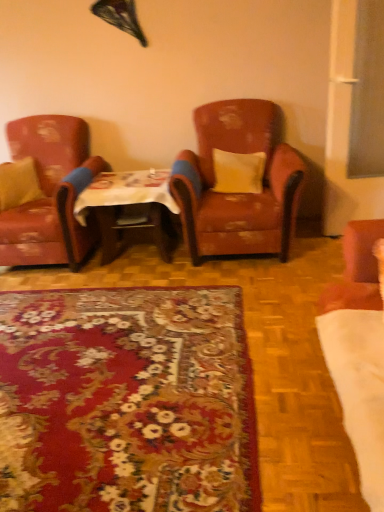
Where is `free space in front of leather-like brown armchair at center, the second chair positioned from the left`? free space in front of leather-like brown armchair at center, the second chair positioned from the left is located at coordinates (263, 289).